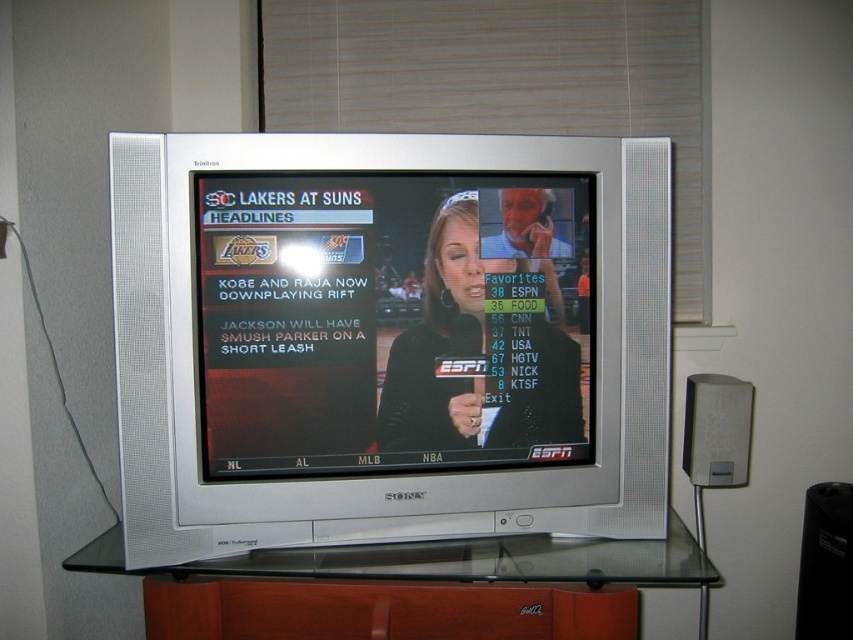
Question: Which point is closer to the camera?

Choices:
 (A) (213, 220)
 (B) (486, 6)
 (C) (672, 541)

Answer: (A)

Question: Is white textured blinds at upper center bigger than black plastic speaker at lower right?

Choices:
 (A) yes
 (B) no

Answer: (A)

Question: Which of these objects is positioned closest to the black fabric at center?

Choices:
 (A) matte black tv screen at center
 (B) white textured blinds at upper center

Answer: (A)

Question: Does matte black tv screen at center appear on the left side of transparent glass entertainment center at center?

Choices:
 (A) no
 (B) yes

Answer: (A)

Question: Which of these objects is positioned closest to the white textured blinds at upper center?

Choices:
 (A) matte black tv screen at center
 (B) black plastic speaker at lower right
 (C) black fabric at center
 (D) satin silver speaker at right

Answer: (D)

Question: Is matte black tv screen at center wider than transparent glass entertainment center at center?

Choices:
 (A) no
 (B) yes

Answer: (A)